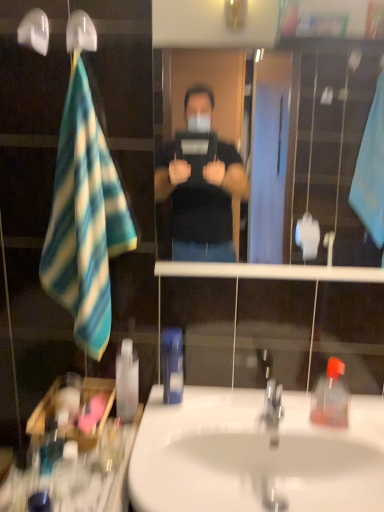
Question: From a real-world perspective, is white plastic shower head at upper left on translucent plastic soap dispenser at right?

Choices:
 (A) no
 (B) yes

Answer: (B)

Question: Can you see white plastic shower head at upper left touching translucent plastic soap dispenser at right?

Choices:
 (A) yes
 (B) no

Answer: (B)

Question: Is white plastic shower head at upper left positioned before translucent plastic soap dispenser at right?

Choices:
 (A) yes
 (B) no

Answer: (A)

Question: Is the depth of white plastic shower head at upper left greater than that of translucent plastic soap dispenser at right?

Choices:
 (A) yes
 (B) no

Answer: (B)

Question: From a real-world perspective, is white plastic shower head at upper left beneath translucent plastic soap dispenser at right?

Choices:
 (A) yes
 (B) no

Answer: (B)

Question: In terms of size, does white glossy sink at center appear bigger or smaller than blue plastic mouthwash at center, marked as the first mouthwash in a right-to-left arrangement?

Choices:
 (A) big
 (B) small

Answer: (A)

Question: Choose the correct answer: Is white glossy sink at center inside blue plastic mouthwash at center, marked as the first mouthwash in a right-to-left arrangement, or outside it?

Choices:
 (A) inside
 (B) outside

Answer: (B)

Question: From a real-world perspective, relative to blue plastic mouthwash at center, the second mouthwash when ordered from front to back, is white glossy sink at center vertically above or below?

Choices:
 (A) above
 (B) below

Answer: (B)

Question: From the image's perspective, is white glossy sink at center located above or below blue plastic mouthwash at center, the third mouthwash from the left?

Choices:
 (A) above
 (B) below

Answer: (B)

Question: Looking at their shapes, would you say blue and white striped towel at left is wider or thinner than white plastic shower head at upper left?

Choices:
 (A) wide
 (B) thin

Answer: (A)

Question: Considering their positions, is blue and white striped towel at left located in front of or behind white plastic shower head at upper left?

Choices:
 (A) behind
 (B) front

Answer: (B)

Question: Considering the relative positions of blue and white striped towel at left and white plastic shower head at upper left in the image provided, is blue and white striped towel at left to the left or to the right of white plastic shower head at upper left?

Choices:
 (A) right
 (B) left

Answer: (B)

Question: Looking at the image, does blue and white striped towel at left seem bigger or smaller compared to white plastic shower head at upper left?

Choices:
 (A) big
 (B) small

Answer: (A)

Question: Based on their positions, is clear glass mirror at center located to the left or right of translucent plastic mouthwash at lower left, which is the 1th mouthwash from back to front?

Choices:
 (A) right
 (B) left

Answer: (A)

Question: Based on their sizes in the image, would you say clear glass mirror at center is bigger or smaller than translucent plastic mouthwash at lower left, which is counted as the 2th mouthwash, starting from the right?

Choices:
 (A) big
 (B) small

Answer: (A)